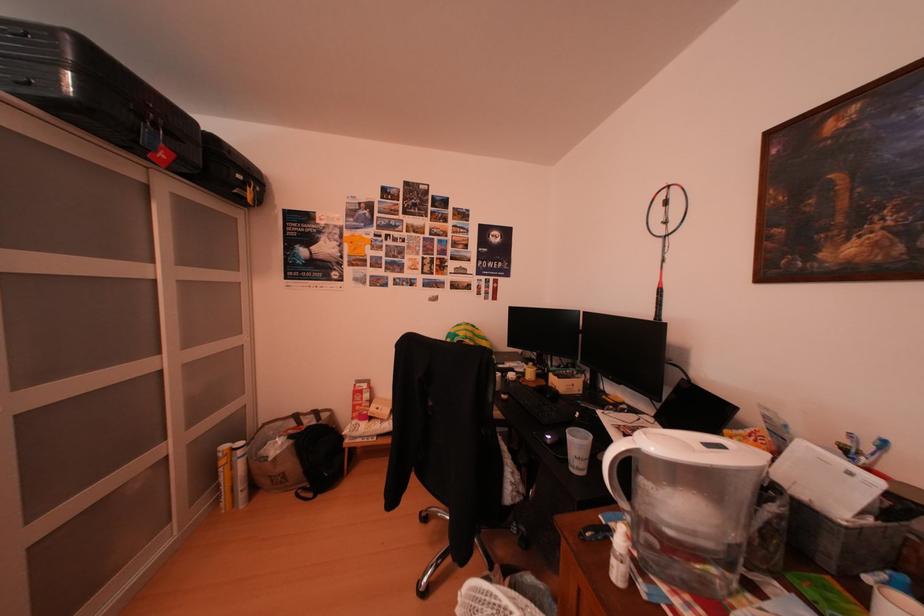
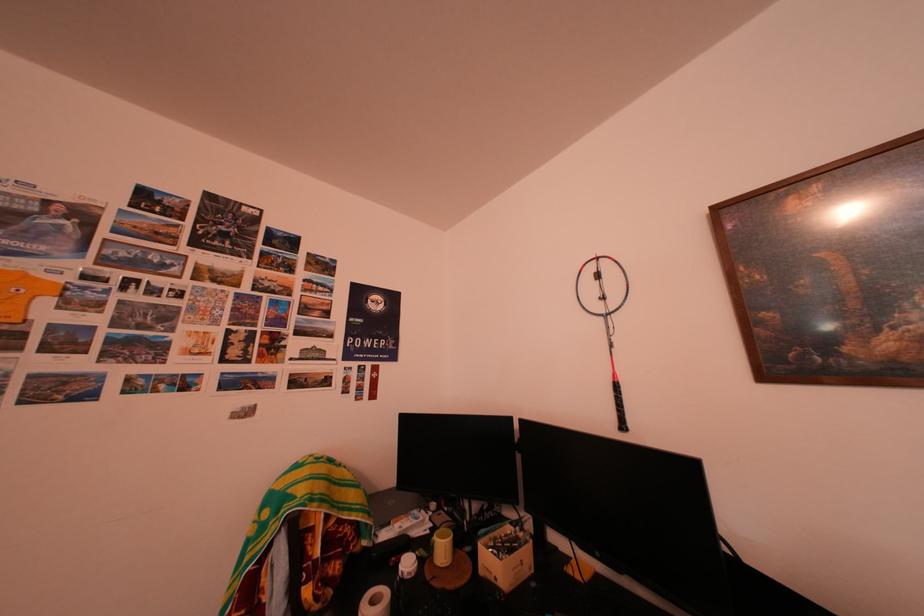
The point at (x=564, y=379) is marked in the first image. Where is the corresponding point in the second image?

(493, 552)